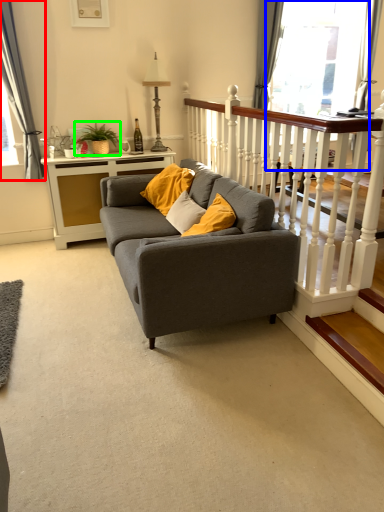
Question: Which is farther away from curtain (highlighted by a red box)? glass door (highlighted by a blue box) or houseplant (highlighted by a green box)?

Choices:
 (A) glass door
 (B) houseplant

Answer: (A)